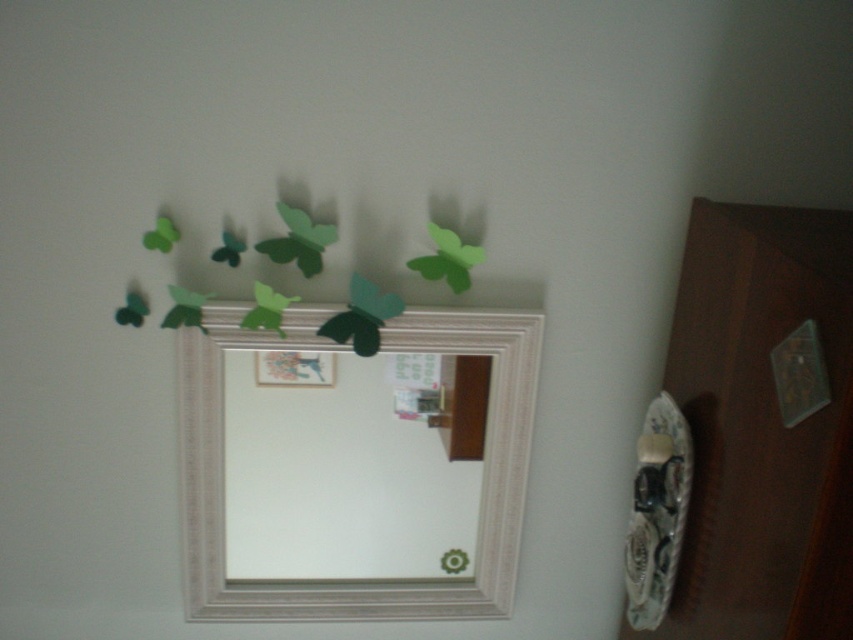
Question: Is wooden dresser at lower right thinner than white textured picture frame at upper center?

Choices:
 (A) no
 (B) yes

Answer: (B)

Question: Is wooden dresser at lower right to the left of white textured picture frame at upper center from the viewer's perspective?

Choices:
 (A) no
 (B) yes

Answer: (A)

Question: Which of the following is the farthest from the observer?

Choices:
 (A) white textured picture frame at upper center
 (B) wooden dresser at lower right

Answer: (A)

Question: Is wooden dresser at lower right wider than white textured picture frame at upper center?

Choices:
 (A) no
 (B) yes

Answer: (A)

Question: Which of the following is the closest to the observer?

Choices:
 (A) (445, 324)
 (B) (744, 211)

Answer: (B)